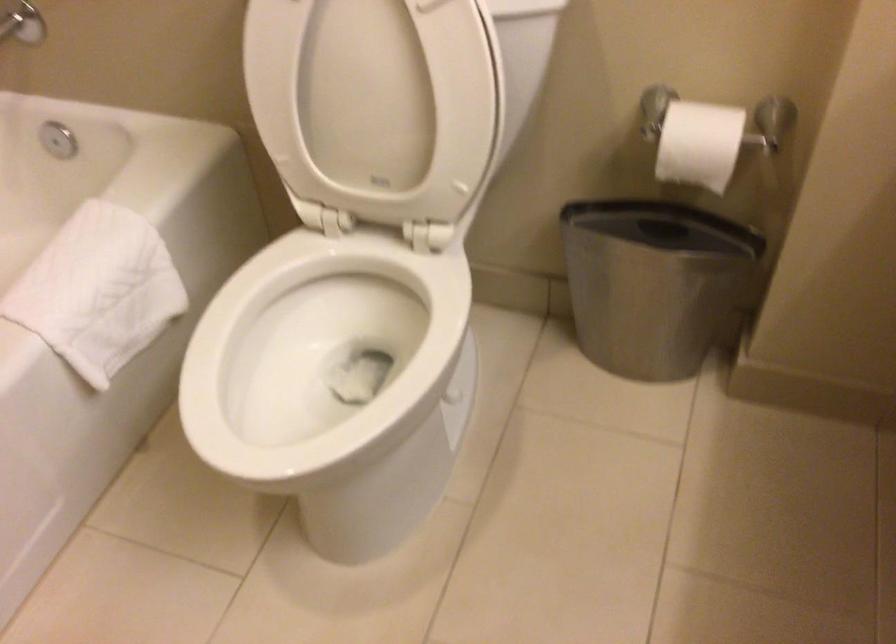
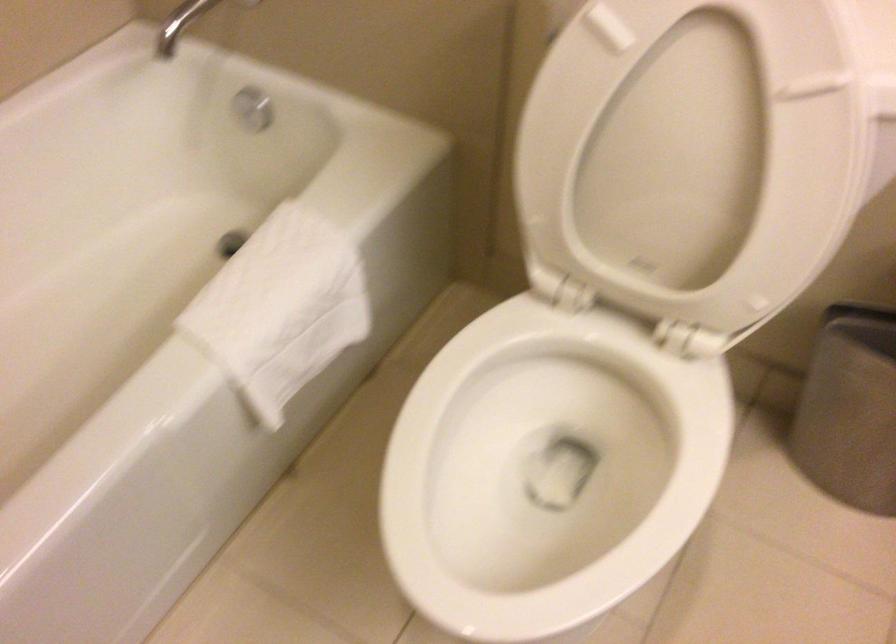
The point at (90, 281) is marked in the first image. Where is the corresponding point in the second image?

(282, 303)